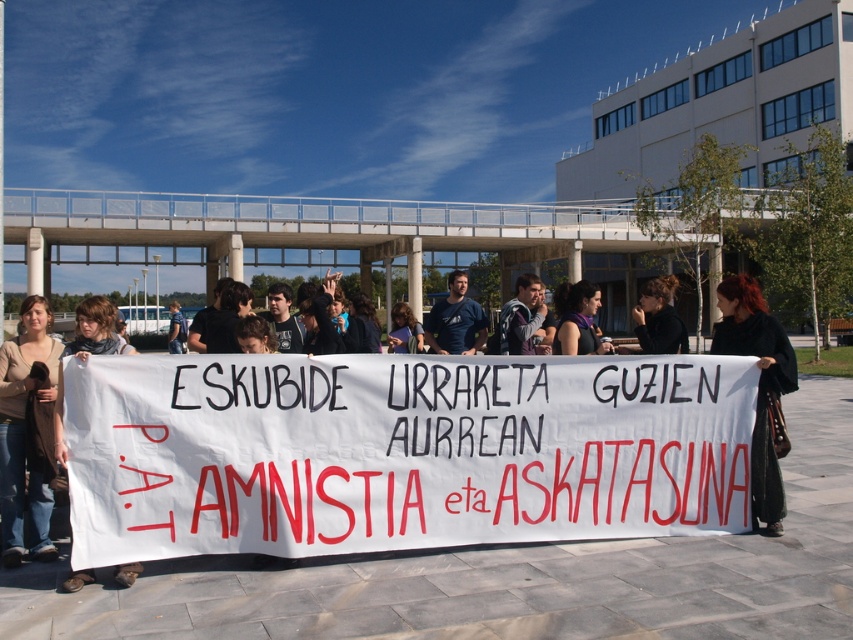
You are a photographer trying to capture the protest scene. You notice two items at the center of the image, the black fabric at center and the purple scarf at center. Which one should you focus on if you want to include both in your photo but prioritize the larger object?

The black fabric at center is bigger than the purple scarf at center, so you should focus on the black fabric at center to prioritize the larger object while including both in the photo.

You are a photographer at the protest scene. You want to take a photo that includes both the dark brown leather jacket at lower right and the gray sweater at center. Based on their positions, which one should you adjust your camera angle to focus on first to ensure both are in frame?

The dark brown leather jacket at lower right is to the right of the gray sweater at center. To include both in the frame, adjust your camera angle to focus on the gray sweater at center first, then pan slightly to the right to include the dark brown leather jacket at lower right.

You are a photographer standing at the edge of the protest group. You want to take a photo that includes both the dark brown leather jacket at lower right and the black fabric at center. What is the minimum distance you need to move backward to ensure both objects are in frame?

The dark brown leather jacket at lower right and black fabric at center are 28.18 inches apart. To include both in the photo, you need to move backward until the camera can capture a field of view that accommodates this distance. The exact distance depends on the camera lens, but generally, moving back about 3 feet would likely ensure both are visible.